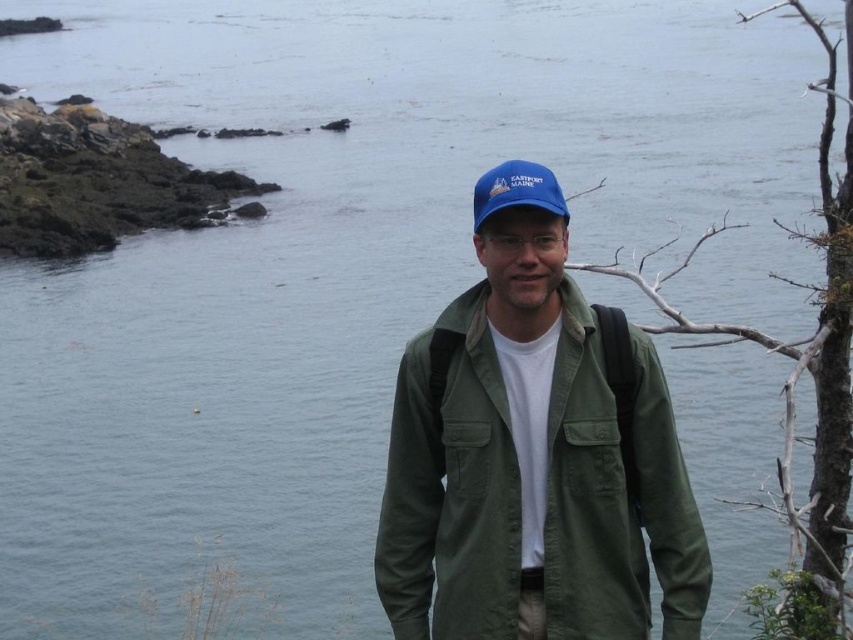
You are a photographer trying to capture a clear shot of the person in the scene. Since the green cotton jacket at center and blue fabric cap at center are both visible, which one do you need to focus on more to ensure the entire subject is in focus?

The green cotton jacket at center is taller than the blue fabric cap at center, so focusing on the green cotton jacket at center will help ensure the entire subject is in focus because it is the taller object and likely covers more of the person.

You are a photographer trying to capture a portrait of the person in the scene. You want to ensure both the green cotton jacket at center and the blue fabric cap at center are clearly visible in the frame. Given their distance apart, what is the minimum focal length lens you should use if your camera sensor size is 36mm x 24mm and you want to maintain both objects in focus without any cropping?

The green cotton jacket at center is 7.04 feet away from the blue fabric cap at center. To ensure both are in focus with a 36mm x 24mm sensor, a lens with a focal length between 50mm to 70mm would be appropriate, as this range provides a balance between field of view and depth of field for portrait photography while keeping both objects in focus.